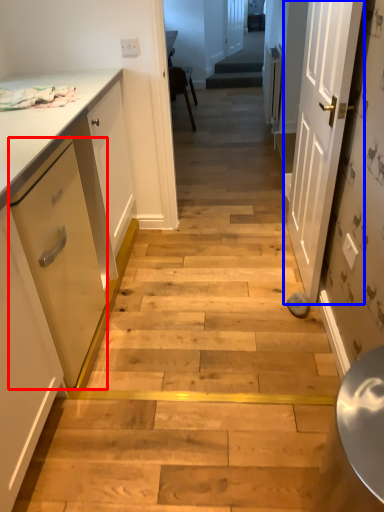
Question: Among these objects, which one is farthest to the camera, drawer (highlighted by a red box) or door (highlighted by a blue box)?

Choices:
 (A) drawer
 (B) door

Answer: (B)